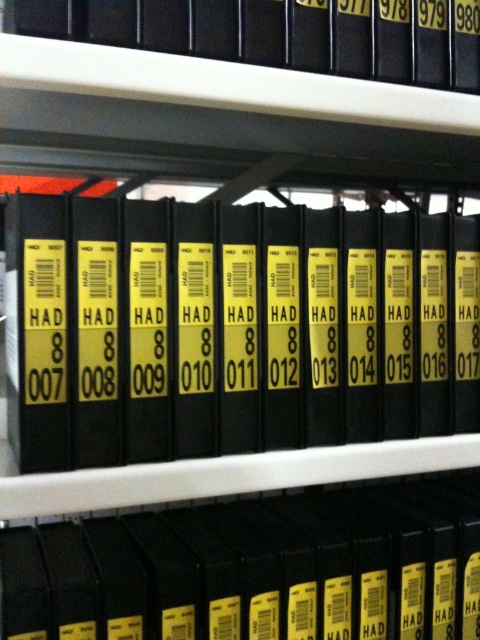
Question: Which point is farther from the camera taking this photo?

Choices:
 (A) [x=344, y=515]
 (B) [x=253, y=3]
 (C) [x=190, y=326]

Answer: (A)

Question: Can you confirm if black matte file at center is positioned above black matte file at upper center?

Choices:
 (A) no
 (B) yes

Answer: (A)

Question: Which point is farther from the camera taking this photo?

Choices:
 (A) (393, 38)
 (B) (418, 310)

Answer: (B)

Question: Which point is farther to the camera?

Choices:
 (A) black matte book at center
 (B) black matte file at upper center
 (C) black matte file at center

Answer: (C)

Question: Does black matte book at center have a larger size compared to black matte file at center?

Choices:
 (A) yes
 (B) no

Answer: (B)

Question: Is black matte book at center in front of black matte file at upper center?

Choices:
 (A) yes
 (B) no

Answer: (B)